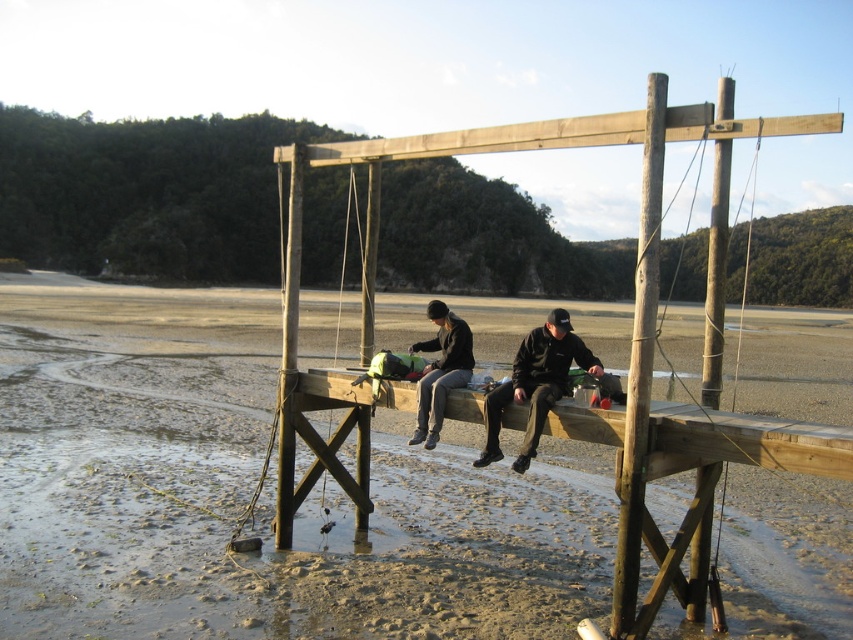
Question: Can you confirm if wooden pier at center is positioned below dark gray knit hat at center?

Choices:
 (A) no
 (B) yes

Answer: (A)

Question: Which object is the farthest from the wooden pier at center?

Choices:
 (A) smooth wooden pole at center
 (B) black matte jacket at center

Answer: (B)

Question: Which is farther from the wooden pier at center?

Choices:
 (A) black matte jacket at center
 (B) smooth wooden pole at center

Answer: (A)

Question: Which point is farther to the camera?

Choices:
 (A) (654, 74)
 (B) (517, 352)
 (C) (260, 353)
 (D) (445, 307)

Answer: (C)

Question: Is wooden pier at center to the left of dark gray knit hat at center from the viewer's perspective?

Choices:
 (A) yes
 (B) no

Answer: (A)

Question: Where is smooth wooden pole at center located in relation to black matte jacket at center in the image?

Choices:
 (A) below
 (B) above

Answer: (B)